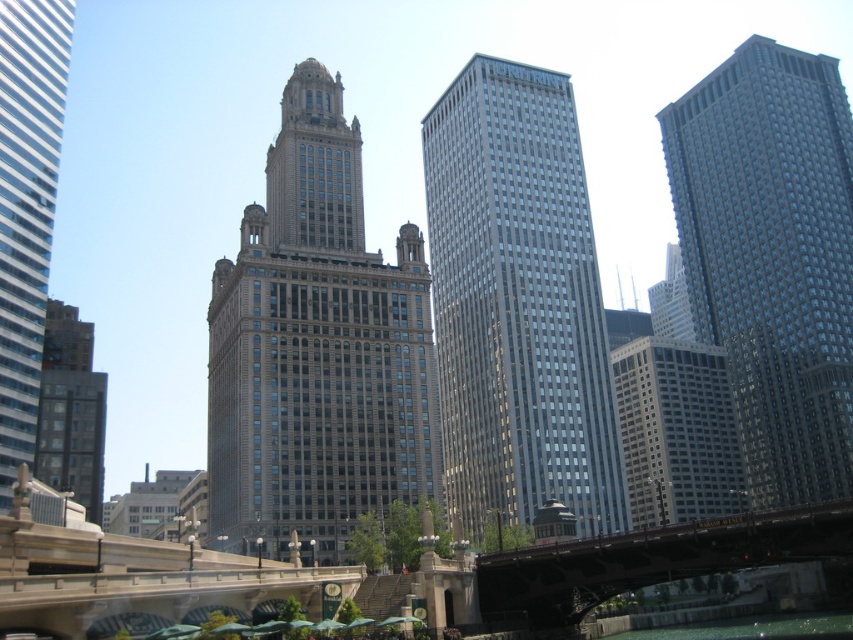
Question: Among these objects, which one is nearest to the camera?

Choices:
 (A) glassy steel skyscraper at right
 (B) matte glass skyscraper at left
 (C) metallic gray bridge at lower center
 (D) beige stone tower at center

Answer: (C)

Question: Is matte glass skyscraper at left wider than dark gray concrete building at lower left?

Choices:
 (A) no
 (B) yes

Answer: (A)

Question: Which of the following is the farthest from the observer?

Choices:
 (A) dark gray concrete building at lower left
 (B) metallic gray bridge at lower center
 (C) glassy steel skyscraper at center
 (D) glassy steel skyscraper at right

Answer: (D)

Question: Among these objects, which one is nearest to the camera?

Choices:
 (A) metallic gray bridge at lower center
 (B) glassy steel skyscraper at center

Answer: (A)

Question: Can you confirm if beige stone tower at center is positioned above glassy steel skyscraper at center?

Choices:
 (A) no
 (B) yes

Answer: (A)

Question: Does beige stone tower at center appear under glassy steel skyscraper at center?

Choices:
 (A) yes
 (B) no

Answer: (A)